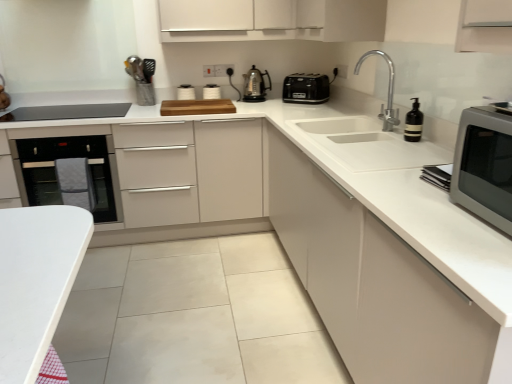
Question: Is white matte cabinet at center, marked as the third cabinetry in a left-to-right arrangement, spatially inside white matte cabinet at upper center, the 2th cabinetry in the right-to-left sequence, or outside of it?

Choices:
 (A) outside
 (B) inside

Answer: (A)

Question: Based on their sizes in the image, would you say white matte cabinet at center, which appears as the first cabinetry when viewed from the right, is bigger or smaller than white matte cabinet at upper center, the 2th cabinetry in the right-to-left sequence?

Choices:
 (A) big
 (B) small

Answer: (A)

Question: Which is nearer to the matte gray microwave at right?

Choices:
 (A) white glossy toaster at upper center
 (B) white matte cabinet at center, the 1th cabinetry when ordered from left to right
 (C) white matte cabinet at upper center, the 2th cabinetry in the right-to-left sequence
 (D) polished chrome faucet at upper right
 (E) satin nickel kettle at center, acting as the 1th kitchen appliance starting from the left

Answer: (D)

Question: Which object is positioned farthest from the black glass oven at left?

Choices:
 (A) white matte cabinet at center, which ranks as the 3th cabinetry in right-to-left order
 (B) polished chrome faucet at upper right
 (C) white glossy toaster at upper center
 (D) matte gray microwave at right
 (E) white matte cabinet at center, marked as the third cabinetry in a left-to-right arrangement

Answer: (D)